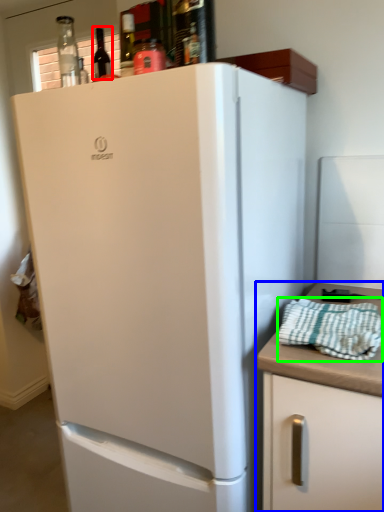
Question: Estimate the real-world distances between objects in this image. Which object is closer to wine bottle (highlighted by a red box), cabinetry (highlighted by a blue box) or blanket (highlighted by a green box)?

Choices:
 (A) cabinetry
 (B) blanket

Answer: (B)